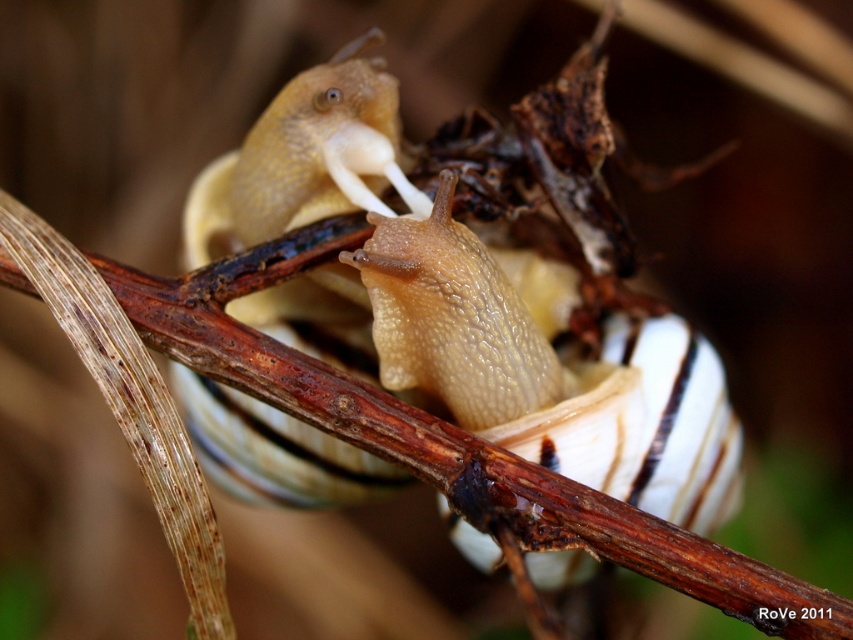
You are a biologist observing two snails on a twig. You notice a point at coordinates (550, 369). What does this point indicate?

The point at coordinates (550, 369) indicates the glossy beige snail at center.

You are a biologist observing two snails on a twig. You notice the glossy beige snail at center and the translucent beige snail at center. Based on their appearance, which snail do you think has a larger width?

The glossy beige snail at center might be wider than translucent beige snail at center, so the glossy beige snail at center likely has a larger width.

You are a nature photographer aiming to capture the glossy beige snail at center. Since the snail is on the brown rough tree branch at center, will the snail be clearly visible against the branch?

The glossy beige snail at center is positioned over the brown rough tree branch at center, so the snail will be clearly visible against the branch due to the contrast between their textures and colors.